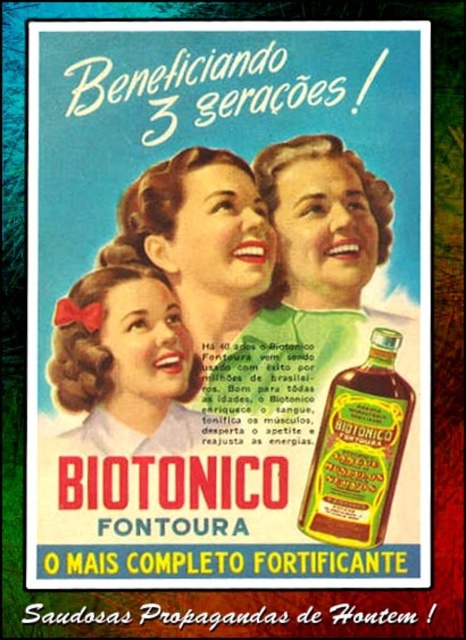
Between matte white blouse at center and green glass bottle at center-right, which one is positioned lower?

Positioned lower is green glass bottle at center-right.

Between point (157, 312) and point (322, 504), which one is positioned behind?

The point (157, 312) is behind.

Where is `matte white blouse at center`? Image resolution: width=466 pixels, height=640 pixels. matte white blouse at center is located at coordinates (124, 364).

Measure the distance between matte green dress at center and camera.

matte green dress at center and camera are 1.32 meters apart from each other.

Which of these two, matte green dress at center or matte white blouse at center, stands shorter?

Standing shorter between the two is matte white blouse at center.

Which is behind, point (226, 266) or point (60, 372)?

The point (226, 266) is more distant.

The image size is (466, 640). In order to click on matte green dress at center in this screenshot , I will do `click(201, 243)`.

Is matte green dress at center above green glass bottle at center-right?

Indeed, matte green dress at center is positioned over green glass bottle at center-right.

Is matte green dress at center to the left of green glass bottle at center-right from the viewer's perspective?

Yes, matte green dress at center is to the left of green glass bottle at center-right.

Who is more distant from viewer, (x=110, y=260) or (x=397, y=417)?

Positioned behind is point (x=110, y=260).

In order to click on matte green dress at center in this screenshot , I will do `click(201, 243)`.